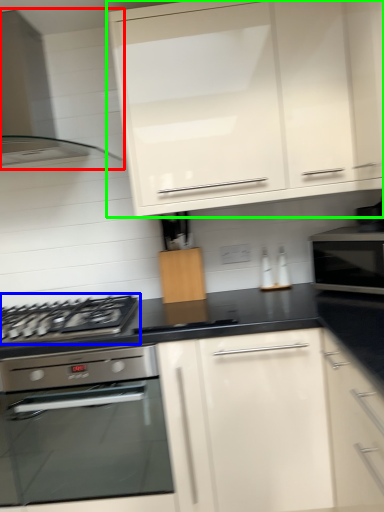
Question: Which object is the farthest from home appliance (highlighted by a red box)? Choose among these: gas stove (highlighted by a blue box) or cabinetry (highlighted by a green box).

Choices:
 (A) gas stove
 (B) cabinetry

Answer: (A)